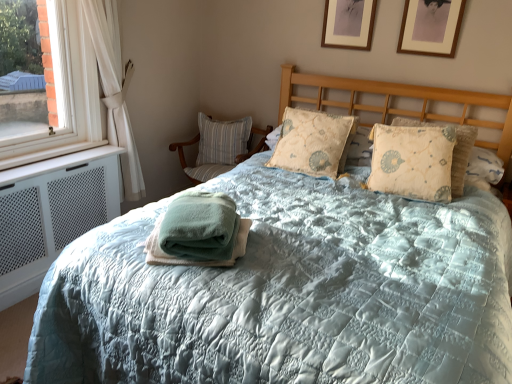
Question: Is the position of green cotton towel at center more distant than that of beige textured pillow at center, marked as the first pillow in a right-to-left arrangement?

Choices:
 (A) no
 (B) yes

Answer: (A)

Question: Is green cotton towel at center in contact with beige textured pillow at center, the third pillow from the left?

Choices:
 (A) no
 (B) yes

Answer: (A)

Question: Is green cotton towel at center smaller than beige textured pillow at center, marked as the first pillow in a right-to-left arrangement?

Choices:
 (A) yes
 (B) no

Answer: (A)

Question: Is beige textured pillow at center, marked as the first pillow in a right-to-left arrangement, located within green cotton towel at center?

Choices:
 (A) yes
 (B) no

Answer: (B)

Question: Is green cotton towel at center positioned in front of beige textured pillow at center, the 1th pillow from the front?

Choices:
 (A) no
 (B) yes

Answer: (B)

Question: Is green cotton towel at center located outside beige textured pillow at center, the third pillow from the left?

Choices:
 (A) no
 (B) yes

Answer: (B)

Question: Does white sheer curtain at left have a smaller size compared to wooden picture frame at upper right, the 2th picture frame from the left?

Choices:
 (A) yes
 (B) no

Answer: (B)

Question: Is white sheer curtain at left next to wooden picture frame at upper right, the 2th picture frame from the left, and touching it?

Choices:
 (A) no
 (B) yes

Answer: (A)

Question: Does white sheer curtain at left have a larger size compared to wooden picture frame at upper right, acting as the first picture frame starting from the right?

Choices:
 (A) yes
 (B) no

Answer: (A)

Question: Can you confirm if white sheer curtain at left is positioned to the left of wooden picture frame at upper right, the 2th picture frame from the left?

Choices:
 (A) no
 (B) yes

Answer: (B)

Question: From the image's perspective, is white sheer curtain at left above wooden picture frame at upper right, acting as the first picture frame starting from the right?

Choices:
 (A) yes
 (B) no

Answer: (B)

Question: Considering the relative positions of white sheer curtain at left and wooden picture frame at upper right, the 2th picture frame from the left, in the image provided, is white sheer curtain at left to the right of wooden picture frame at upper right, the 2th picture frame from the left, from the viewer's perspective?

Choices:
 (A) yes
 (B) no

Answer: (B)

Question: From a real-world perspective, is white sheer curtain at left below white mesh air conditioner at left?

Choices:
 (A) yes
 (B) no

Answer: (B)